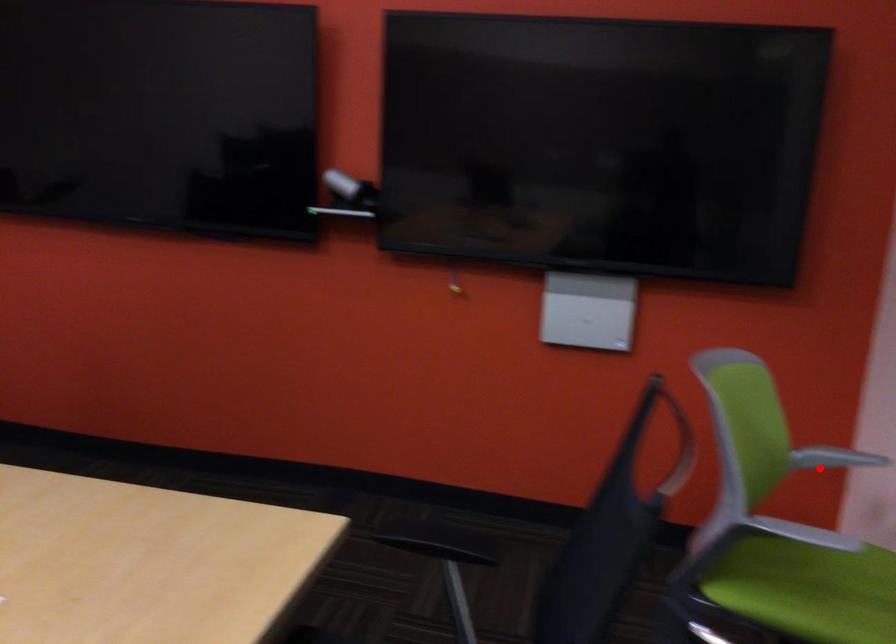
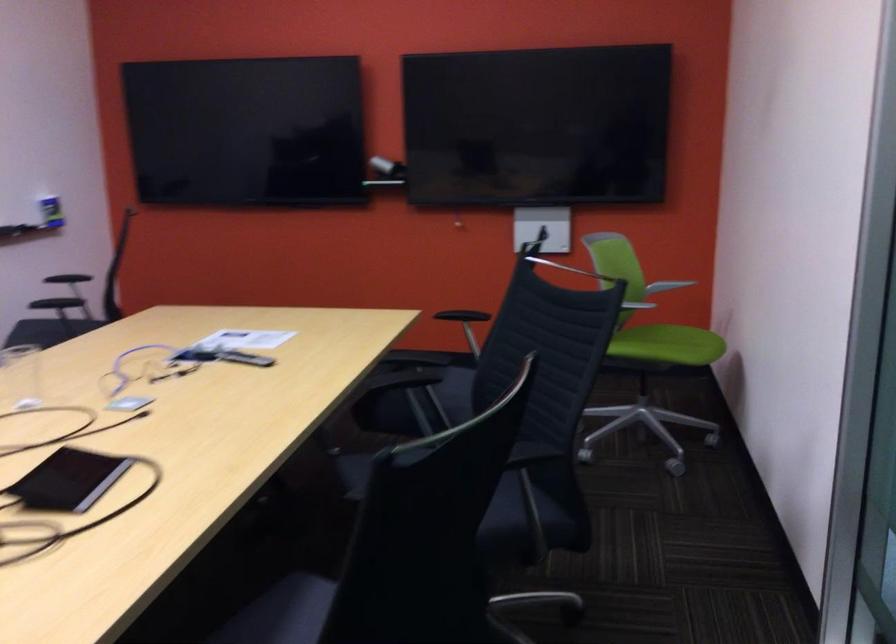
Question: I am providing you with two images of the same scene from different viewpoints. In image1, a red point is highlighted. Considering the same 3D point in image2, which of the following is correct?

Choices:
 (A) It is closer
 (B) It is farther

Answer: (B)